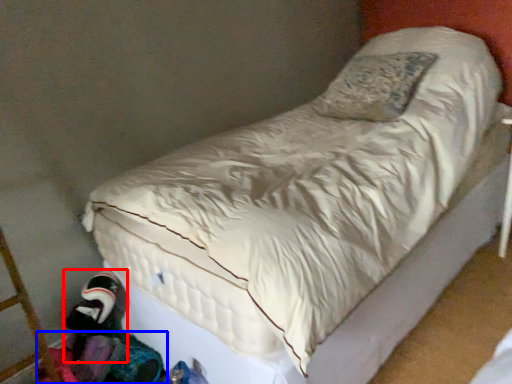
Question: Which object is closer to the camera taking this photo, toy (highlighted by a red box) or clothing (highlighted by a blue box)?

Choices:
 (A) toy
 (B) clothing

Answer: (B)